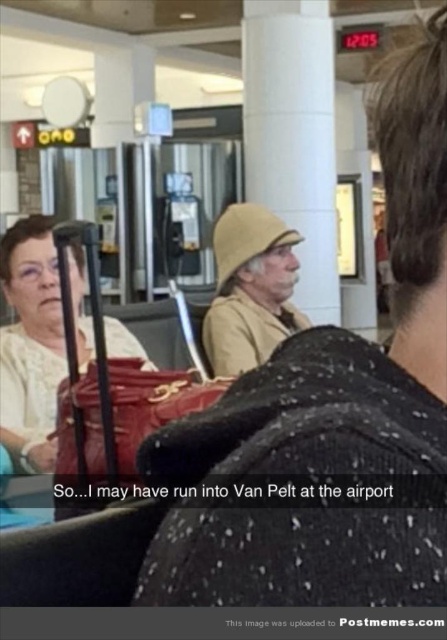
You are an airport staff member and you need to find the smaller beige fabric hat. Which one between the beige fabric hat at upper center and the beige fabric hat at center should you choose?

The beige fabric hat at upper center has a smaller size compared to the beige fabric hat at center, so you should choose the beige fabric hat at upper center.

You are an airport staff member who needs to store luggage temporarily. You see the matte black suitcase at left and the beige fabric hat at center. Which object is taller and can be placed on a shelf that requires items to be at least 1.2 meters in height?

The matte black suitcase at left is much taller than the beige fabric hat at center, so it can be placed on the shelf that requires items to be at least 1.2 meters in height.